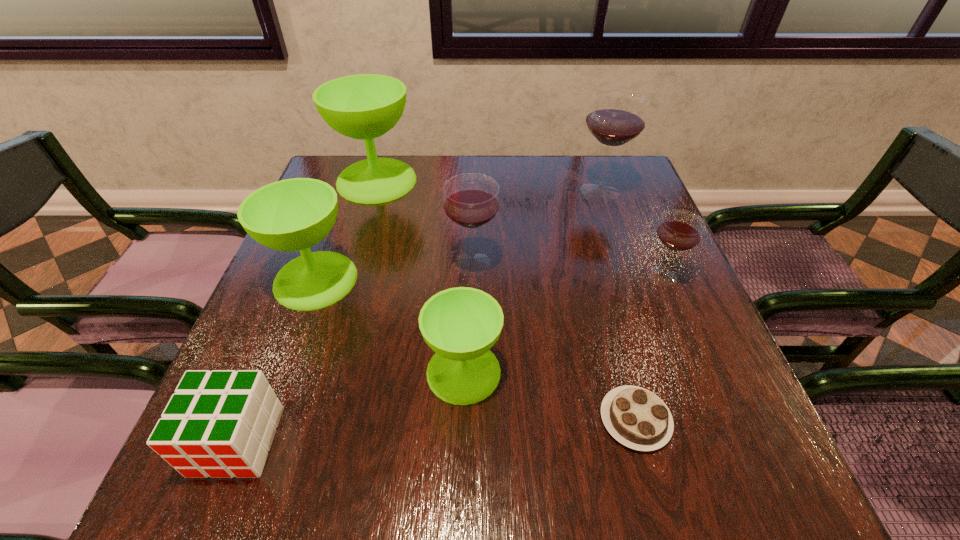
Find the location of a particular element. The height and width of the screenshot is (540, 960). vacant space at the near right corner of the desktop is located at coordinates (707, 457).

I want to click on free space between the second farthest green wineglass and the cube, so click(276, 360).

Identify the location of vacant point located between the seventh tallest object and the shortest object. The image size is (960, 540). [436, 430].

Identify the location of free space between the second farthest green wineglass and the cube. This screenshot has width=960, height=540. (276, 360).

Where is `unoccupied area between the smallest red wineglass and the farthest green wineglass`? Image resolution: width=960 pixels, height=540 pixels. unoccupied area between the smallest red wineglass and the farthest green wineglass is located at coordinates (519, 228).

Image resolution: width=960 pixels, height=540 pixels. Identify the location of vacant area that lies between the shortest object and the biggest red wineglass. (617, 306).

Identify the location of empty space that is in between the rightmost green wineglass and the biggest red wineglass. This screenshot has width=960, height=540. (532, 281).

Where is `unoccupied position between the farthest red wineglass and the nearest green wineglass`? unoccupied position between the farthest red wineglass and the nearest green wineglass is located at coordinates tap(532, 281).

Find the location of a particular element. This screenshot has height=540, width=960. free space between the nearest wineglass and the biggest green wineglass is located at coordinates (420, 276).

Find the location of a particular element. The height and width of the screenshot is (540, 960). free space that is in between the biggest red wineglass and the chocolate cake is located at coordinates (617, 306).